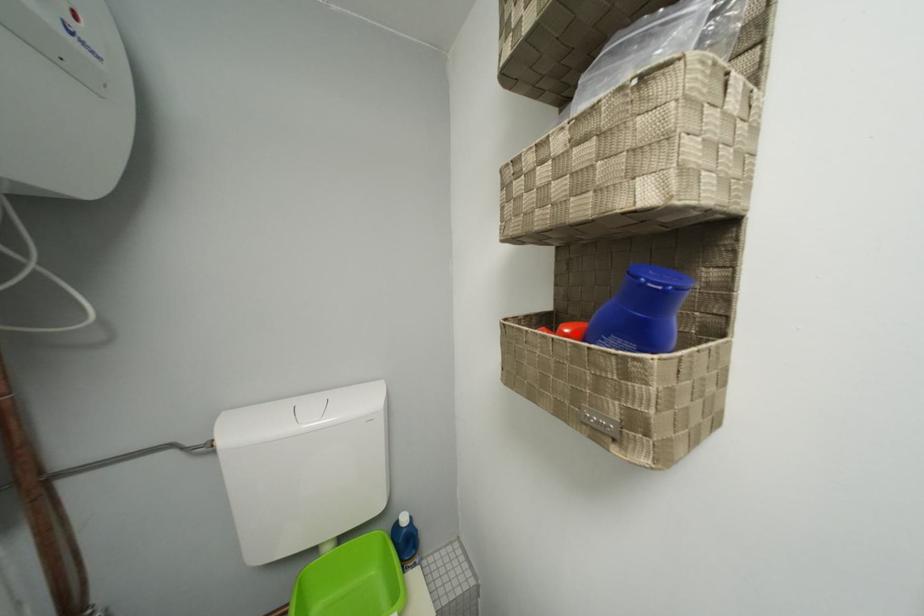
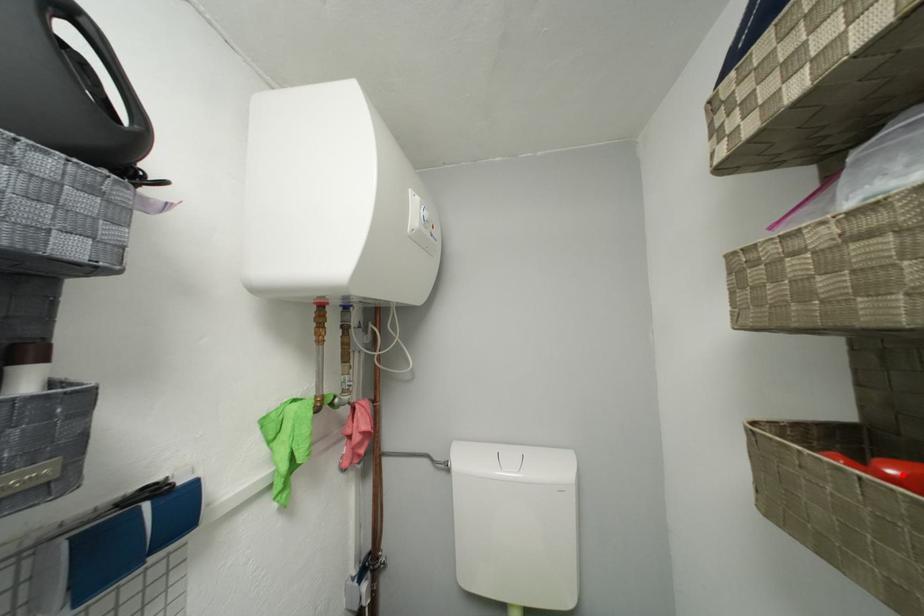
I am providing you with two images of the same scene from different viewpoints. A red point is marked on the first image and another point is marked on the second image. Are the points marked in image1 and image2 representing the same 3D position?

Yes